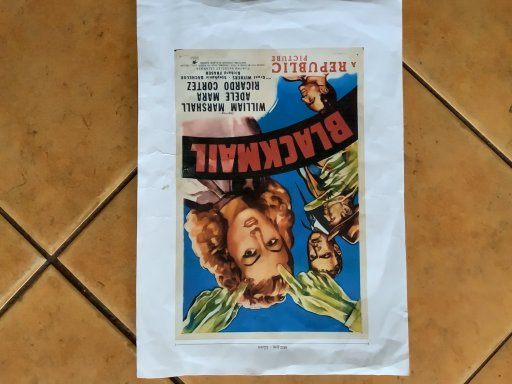
Question: Should I look upward or downward to see matte paper poster at center?

Choices:
 (A) up
 (B) down

Answer: (A)